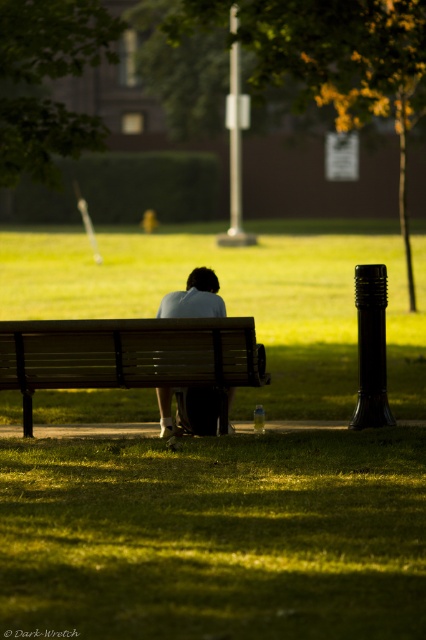
Who is taller, green leafy tree at upper center or wooden bench at center?

green leafy tree at upper center is taller.

Image resolution: width=426 pixels, height=640 pixels. Find the location of `green leafy tree at upper center`. green leafy tree at upper center is located at coordinates (324, 58).

Is point (344, 99) behind point (222, 362)?

Yes, point (344, 99) is farther from viewer.

In order to click on green leafy tree at upper center in this screenshot , I will do `click(324, 58)`.

Image resolution: width=426 pixels, height=640 pixels. What are the coordinates of `green leafy tree at upper left` in the screenshot? It's located at (49, 77).

Does green leafy tree at upper left have a lesser width compared to light blue fabric shirt at center?

Incorrect, green leafy tree at upper left's width is not less than light blue fabric shirt at center's.

Image resolution: width=426 pixels, height=640 pixels. Find the location of `green leafy tree at upper left`. green leafy tree at upper left is located at coordinates (49, 77).

At what (x,y) coordinates should I click in order to perform the action: click on green leafy tree at upper left. Please return your answer as a coordinate pair (x, y). Looking at the image, I should click on (x=49, y=77).

Is green grass at lower center taller than light blue fabric shirt at center?

In fact, green grass at lower center may be shorter than light blue fabric shirt at center.

Between green grass at lower center and light blue fabric shirt at center, which one is positioned higher?

light blue fabric shirt at center is higher up.

Measure the distance between green grass at lower center and camera.

The distance of green grass at lower center from camera is 6.32 meters.

The height and width of the screenshot is (640, 426). What are the coordinates of `green grass at lower center` in the screenshot? It's located at (215, 536).